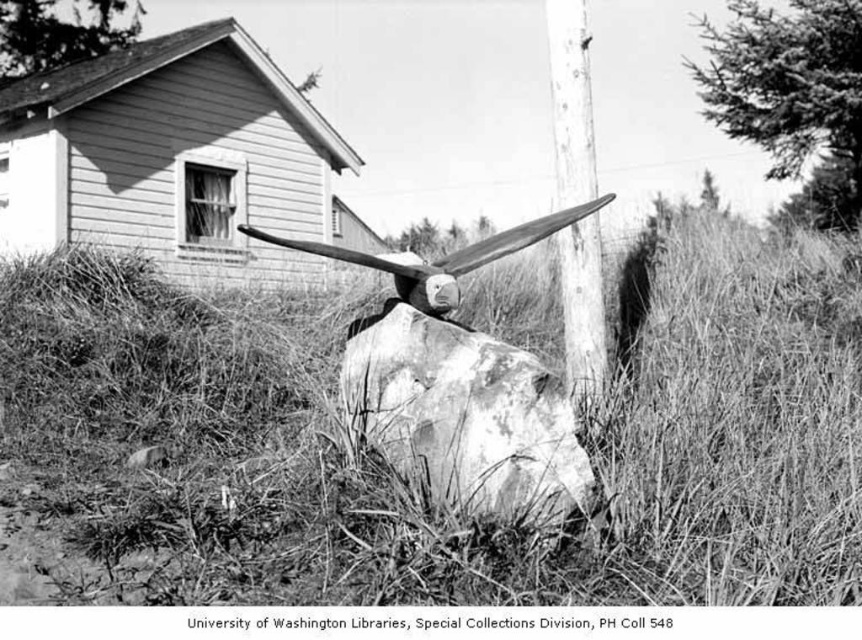
Is smooth wood pole at center shorter than wooden propeller at center?

No, smooth wood pole at center is not shorter than wooden propeller at center.

Does smooth wood pole at center come in front of wooden propeller at center?

No.

Is point (597, 237) farther from viewer compared to point (410, 301)?

Yes, it is.

What are the coordinates of `smooth wood pole at center` in the screenshot? It's located at (570, 100).

Does speckled concrete rock at center appear on the right side of smooth wood pole at center?

In fact, speckled concrete rock at center is to the left of smooth wood pole at center.

Is point (547, 424) closer to camera compared to point (561, 193)?

Yes, point (547, 424) is in front of point (561, 193).

Where is `speckled concrete rock at center`? The height and width of the screenshot is (640, 862). speckled concrete rock at center is located at coordinates (464, 417).

Can you confirm if dry grass at center is thinner than smooth wood pole at center?

Incorrect, dry grass at center's width is not less than smooth wood pole at center's.

Measure the distance between dry grass at center and smooth wood pole at center.

dry grass at center and smooth wood pole at center are 3.63 meters apart.

Who is more distant from viewer, (395,538) or (590,396)?

The point (590,396) is more distant.

The width and height of the screenshot is (862, 640). In order to click on dry grass at center in this screenshot , I will do `click(438, 435)`.